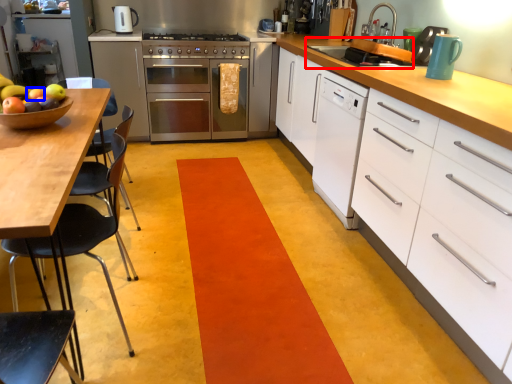
Question: Which object appears closest to the camera in this image, sink (highlighted by a red box) or apple (highlighted by a blue box)?

Choices:
 (A) sink
 (B) apple

Answer: (B)